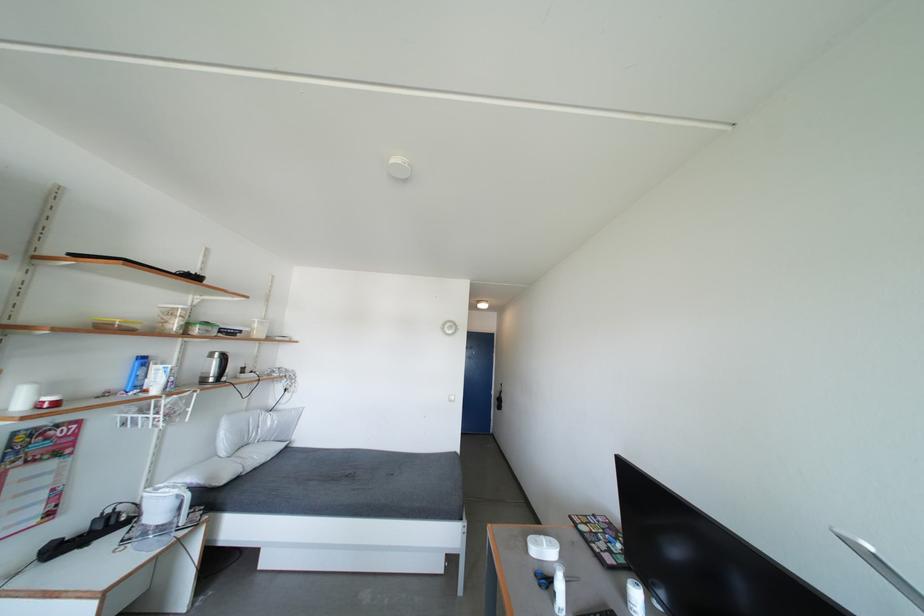
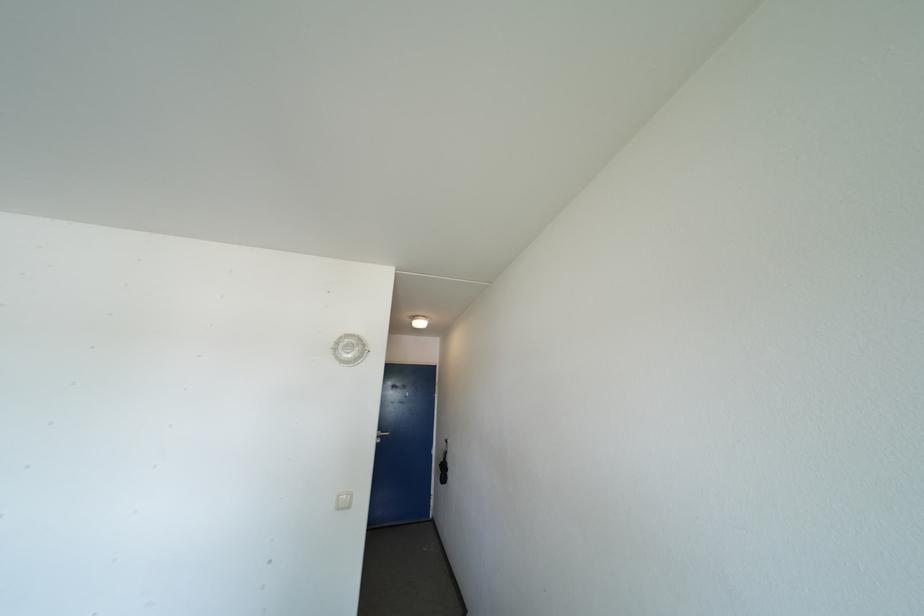
Question: Which direction would the cameraman need to move to produce the second image? Reply with the corresponding letter.

Choices:
 (A) Left
 (B) Right
 (C) Forward
 (D) Backward

Answer: (C)